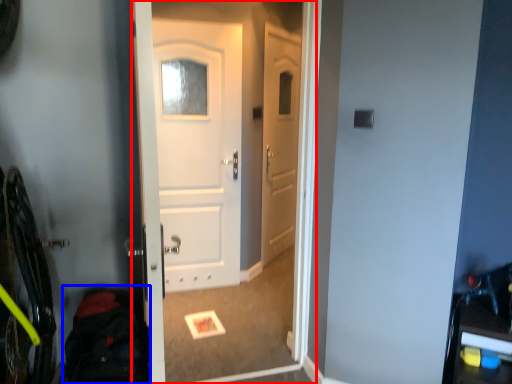
Question: Which object appears farthest to the camera in this image, screen door (highlighted by a red box) or back (highlighted by a blue box)?

Choices:
 (A) screen door
 (B) back

Answer: (A)